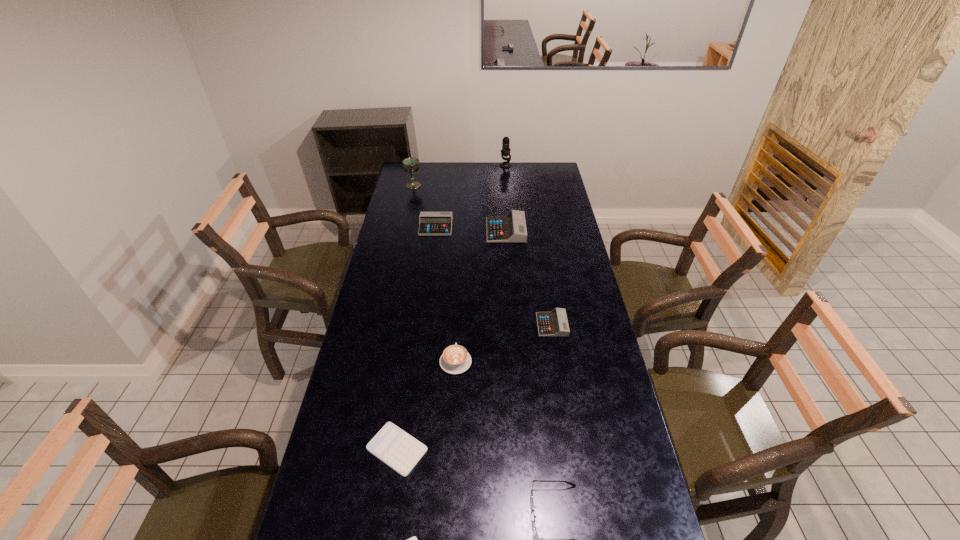
This screenshot has width=960, height=540. Find the location of `vacant area situated 0.400m on the left of the third farthest calculator`. vacant area situated 0.400m on the left of the third farthest calculator is located at coordinates (431, 325).

Image resolution: width=960 pixels, height=540 pixels. In order to click on vacant region located 0.090m on the right of the bigger white calculator in this screenshot , I will do `click(458, 449)`.

At what (x,y) coordinates should I click in order to perform the action: click on microphone present at the far edge. Please return your answer as a coordinate pair (x, y). Looking at the image, I should click on (505, 151).

Locate an element on the screen. chalice at the far edge is located at coordinates (411, 165).

Locate an element on the screen. The width and height of the screenshot is (960, 540). chalice that is at the left edge is located at coordinates (411, 165).

I want to click on object situated at the right edge, so click(x=550, y=324).

I want to click on object that is at the far left corner, so click(x=411, y=165).

Image resolution: width=960 pixels, height=540 pixels. In the image, there is a desktop. What are the coordinates of `vacant area at the far edge` in the screenshot? It's located at (450, 178).

You are a GUI agent. You are given a task and a screenshot of the screen. Output one action in this format:
    pyautogui.click(x=<x>, y=<y>)
    Task: Click on the free region at the left edge
    This screenshot has height=540, width=960.
    Given the screenshot: What is the action you would take?
    pyautogui.click(x=418, y=205)

In the image, there is a desktop. Identify the location of free region at the right edge. This screenshot has height=540, width=960. (567, 219).